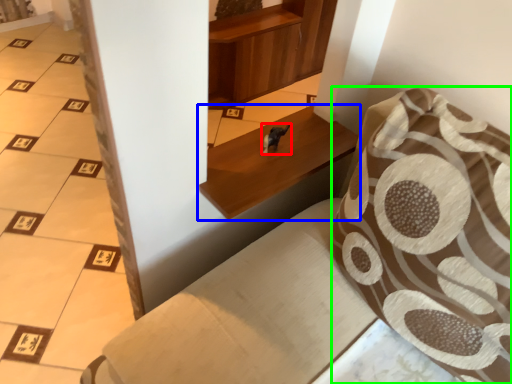
Question: Which object is the farthest from animal (highlighted by a red box)? Choose among these: furniture (highlighted by a blue box) or throw pillow (highlighted by a green box).

Choices:
 (A) furniture
 (B) throw pillow

Answer: (B)